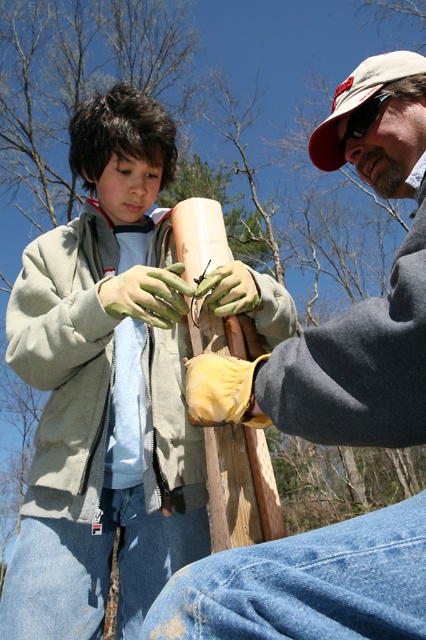
Question: Among these points, which one is nearest to the camera?

Choices:
 (A) (310, 147)
 (B) (29, 608)

Answer: (B)

Question: Which is farther from the matte green jacket at center?

Choices:
 (A) matte gray jacket at center
 (B) white fabric baseball cap at upper right

Answer: (B)

Question: Can you confirm if matte gray jacket at center is positioned below white fabric baseball cap at upper right?

Choices:
 (A) yes
 (B) no

Answer: (A)

Question: Which object is closer to the camera taking this photo?

Choices:
 (A) white fabric baseball cap at upper right
 (B) matte green jacket at center

Answer: (B)

Question: Does matte green jacket at center appear on the right side of white fabric baseball cap at upper right?

Choices:
 (A) yes
 (B) no

Answer: (B)

Question: Can you confirm if matte green jacket at center is smaller than matte gray jacket at center?

Choices:
 (A) yes
 (B) no

Answer: (B)